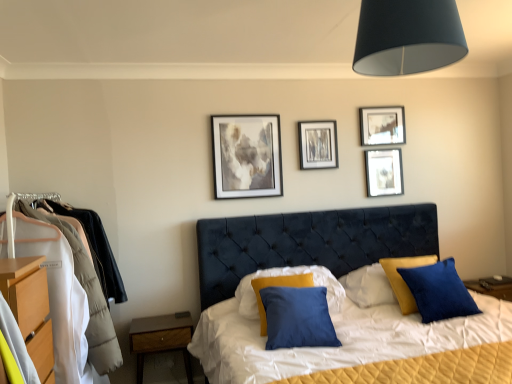
What do you see at coordinates (384, 172) in the screenshot? I see `matte silver picture frame at upper right, which is the fourth picture frame from left to right` at bounding box center [384, 172].

Identify the location of blue cotton pillow at center, the second pillow in the left-to-right sequence. (438, 291).

Measure the distance between point (183, 326) and camera.

A distance of 2.85 meters exists between point (183, 326) and camera.

At what (x,y) coordinates should I click in order to perform the action: click on matte silver picture frame at upper right, the 1th picture frame from the right. Please return your answer as a coordinate pair (x, y). Looking at the image, I should click on (384, 172).

Is satin blue pillow at center, arranged as the 2th pillow when viewed from the right, at the right side of black matte lampshade at upper center?

No, satin blue pillow at center, arranged as the 2th pillow when viewed from the right, is not to the right of black matte lampshade at upper center.

Is black matte lampshade at upper center at the back of satin blue pillow at center, which appears as the 1th pillow when viewed from the left?

That's not correct — satin blue pillow at center, which appears as the 1th pillow when viewed from the left, is not looking away from black matte lampshade at upper center.

Considering the relative sizes of satin blue pillow at center, arranged as the 2th pillow when viewed from the right, and black matte lampshade at upper center in the image provided, is satin blue pillow at center, arranged as the 2th pillow when viewed from the right, shorter than black matte lampshade at upper center?

No.

Measure the distance from satin blue pillow at center, which appears as the 1th pillow when viewed from the left, to black matte lampshade at upper center.

satin blue pillow at center, which appears as the 1th pillow when viewed from the left, is 1.46 meters away from black matte lampshade at upper center.

Is black matte lampshade at upper center to the left or to the right of wooden dresser at left in the image?

From the image, it's evident that black matte lampshade at upper center is to the right of wooden dresser at left.

From the image's perspective, is black matte lampshade at upper center over wooden dresser at left?

Indeed, from the image's perspective, black matte lampshade at upper center is shown above wooden dresser at left.

Consider the image. Considering the relative sizes of black matte lampshade at upper center and wooden dresser at left in the image provided, is black matte lampshade at upper center thinner than wooden dresser at left?

Yes.

Is black matte lampshade at upper center completely or partially outside of wooden dresser at left?

black matte lampshade at upper center lies outside wooden dresser at left's area.

Could matte gray painting at upper center, which appears as the fourth picture frame when viewed from the right, be considered to be inside black matte lampshade at upper center?

No, matte gray painting at upper center, which appears as the fourth picture frame when viewed from the right, is not surrounded by black matte lampshade at upper center.

Is black matte lampshade at upper center bigger or smaller than matte gray painting at upper center, which appears as the fourth picture frame when viewed from the right?

Clearly, black matte lampshade at upper center is larger in size than matte gray painting at upper center, which appears as the fourth picture frame when viewed from the right.

Relative to matte gray painting at upper center, marked as the 1th picture frame in a left-to-right arrangement, is black matte lampshade at upper center in front or behind?

black matte lampshade at upper center is positioned closer to the viewer than matte gray painting at upper center, marked as the 1th picture frame in a left-to-right arrangement.

Between black matte lampshade at upper center and matte gray painting at upper center, which appears as the fourth picture frame when viewed from the right, which one has more height?

matte gray painting at upper center, which appears as the fourth picture frame when viewed from the right, is taller.

Considering the relative positions of brown wood nightstand at lower left and blue cotton pillow at center, which is the 1th pillow from right to left, in the image provided, is brown wood nightstand at lower left to the right of blue cotton pillow at center, which is the 1th pillow from right to left, from the viewer's perspective?

In fact, brown wood nightstand at lower left is to the left of blue cotton pillow at center, which is the 1th pillow from right to left.

Can you confirm if brown wood nightstand at lower left is taller than blue cotton pillow at center, which is the 1th pillow from right to left?

In fact, brown wood nightstand at lower left may be shorter than blue cotton pillow at center, which is the 1th pillow from right to left.

Does brown wood nightstand at lower left have a larger size compared to blue cotton pillow at center, the second pillow in the left-to-right sequence?

Correct, brown wood nightstand at lower left is larger in size than blue cotton pillow at center, the second pillow in the left-to-right sequence.

Is brown wood nightstand at lower left wider or thinner than blue cotton pillow at center, the second pillow in the left-to-right sequence?

Clearly, brown wood nightstand at lower left has more width compared to blue cotton pillow at center, the second pillow in the left-to-right sequence.

Is metallic silver picture frame at upper center, the 3th picture frame in the right-to-left sequence, at the back of matte black picture frame at upper right, acting as the second picture frame starting from the right?

No, metallic silver picture frame at upper center, the 3th picture frame in the right-to-left sequence, is not at the back of matte black picture frame at upper right, acting as the second picture frame starting from the right.

Locate an element on the screen. the 1st picture frame positioned below the matte black picture frame at upper right, acting as the second picture frame starting from the right (from the image's perspective) is located at coordinates (318, 144).

Is the surface of matte black picture frame at upper right, acting as the second picture frame starting from the right, in direct contact with metallic silver picture frame at upper center, which is the second picture frame in left-to-right order?

No, matte black picture frame at upper right, acting as the second picture frame starting from the right, is not making contact with metallic silver picture frame at upper center, which is the second picture frame in left-to-right order.

Is black matte lampshade at upper center at the back of wooden dresser at left?

No, wooden dresser at left's orientation is not away from black matte lampshade at upper center.

Does point (99, 290) appear closer or farther from the camera than point (410, 8)?

Clearly, point (99, 290) is more distant from the camera than point (410, 8).

Who is smaller, wooden dresser at left or black matte lampshade at upper center?

Smaller between the two is wooden dresser at left.

Considering the relative positions of wooden dresser at left and black matte lampshade at upper center in the image provided, is wooden dresser at left to the left of black matte lampshade at upper center from the viewer's perspective?

Correct, you'll find wooden dresser at left to the left of black matte lampshade at upper center.

Considering the sizes of objects wooden dresser at left and matte silver picture frame at upper right, which is the fourth picture frame from left to right, in the image provided, who is taller, wooden dresser at left or matte silver picture frame at upper right, which is the fourth picture frame from left to right,?

With more height is wooden dresser at left.

From the wooden dresser at left, count 4th picture frames backward and point to it. Please provide its 2D coordinates.

[(384, 172)]

From a real-world perspective, does wooden dresser at left stand above matte silver picture frame at upper right, which is the fourth picture frame from left to right?

No.

Is point (101, 303) positioned after point (397, 161)?

No, it is not.

This screenshot has height=384, width=512. I want to click on light fixture that appears on the right of satin blue pillow at center, arranged as the 2th pillow when viewed from the right, so click(407, 37).

The width and height of the screenshot is (512, 384). I want to click on light fixture above the wooden dresser at left (from a real-world perspective), so click(x=407, y=37).

Estimate the real-world distances between objects in this image. Which object is further from matte silver picture frame at upper right, which is the fourth picture frame from left to right, brown wood nightstand at lower left or black matte lampshade at upper center?

Based on the image, brown wood nightstand at lower left appears to be further to matte silver picture frame at upper right, which is the fourth picture frame from left to right.

From the image, which object appears to be nearer to blue cotton pillow at center, the second pillow in the left-to-right sequence, wooden dresser at left or metallic silver picture frame at upper center, the 3th picture frame in the right-to-left sequence?

metallic silver picture frame at upper center, the 3th picture frame in the right-to-left sequence.

Based on their spatial positions, is matte gray painting at upper center, which appears as the fourth picture frame when viewed from the right, or matte silver picture frame at upper right, the 1th picture frame from the right, closer to satin blue pillow at center, arranged as the 2th pillow when viewed from the right?

Based on the image, matte gray painting at upper center, which appears as the fourth picture frame when viewed from the right, appears to be nearer to satin blue pillow at center, arranged as the 2th pillow when viewed from the right.

From the image, which object appears to be nearer to wooden dresser at left, blue cotton pillow at center, which is the 1th pillow from right to left, or matte gray painting at upper center, marked as the 1th picture frame in a left-to-right arrangement?

matte gray painting at upper center, marked as the 1th picture frame in a left-to-right arrangement, lies closer to wooden dresser at left than the other object.

Estimate the real-world distances between objects in this image. Which object is further from wooden dresser at left, matte black picture frame at upper right, acting as the second picture frame starting from the right, or satin blue pillow at center, which appears as the 1th pillow when viewed from the left?

matte black picture frame at upper right, acting as the second picture frame starting from the right, is positioned further to the anchor wooden dresser at left.

Estimate the real-world distances between objects in this image. Which object is further from brown wood nightstand at lower left, wooden dresser at left or matte black picture frame at upper right, acting as the second picture frame starting from the right?

matte black picture frame at upper right, acting as the second picture frame starting from the right, is positioned further to the anchor brown wood nightstand at lower left.

From the picture: From the image, which object appears to be farther from matte black picture frame at upper right, acting as the second picture frame starting from the right, satin blue pillow at center, arranged as the 2th pillow when viewed from the right, or matte silver picture frame at upper right, the 1th picture frame from the right?

Based on the image, satin blue pillow at center, arranged as the 2th pillow when viewed from the right, appears to be further to matte black picture frame at upper right, acting as the second picture frame starting from the right.

Which object lies further to the anchor point satin blue pillow at center, which appears as the 1th pillow when viewed from the left, wooden dresser at left or blue cotton pillow at center, the second pillow in the left-to-right sequence?

wooden dresser at left is positioned further to the anchor satin blue pillow at center, which appears as the 1th pillow when viewed from the left.

This screenshot has width=512, height=384. I want to click on picture frame between wooden dresser at left and metallic silver picture frame at upper center, which is the second picture frame in left-to-right order, from front to back, so click(x=247, y=156).

Identify the location of light fixture between wooden dresser at left and matte black picture frame at upper right, the third picture frame positioned from the left, in the horizontal direction. (407, 37).

The height and width of the screenshot is (384, 512). What are the coordinates of `pillow between brown wood nightstand at lower left and matte silver picture frame at upper right, which is the fourth picture frame from left to right, in the horizontal direction` in the screenshot? It's located at (292, 278).

At what (x,y) coordinates should I click in order to perform the action: click on nightstand between wooden dresser at left and matte black picture frame at upper right, the third picture frame positioned from the left. Please return your answer as a coordinate pair (x, y). The image size is (512, 384). Looking at the image, I should click on (161, 338).